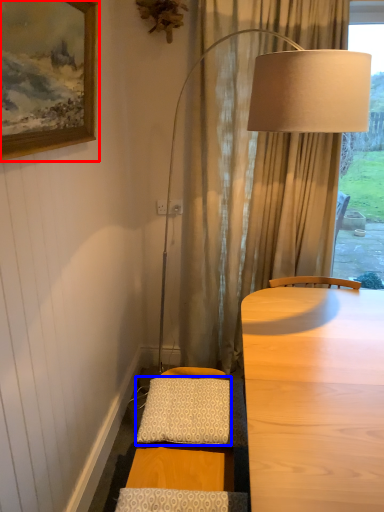
Question: Which object appears farthest to the camera in this image, picture frame (highlighted by a red box) or pillow (highlighted by a blue box)?

Choices:
 (A) picture frame
 (B) pillow

Answer: (B)